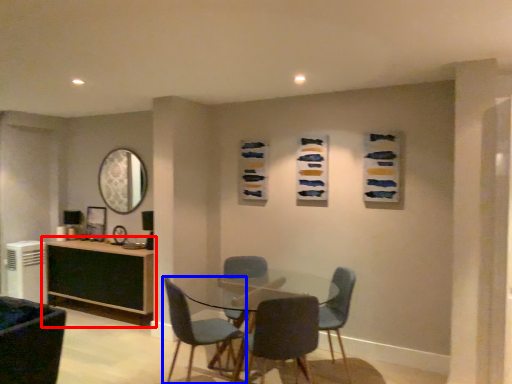
Question: Among these objects, which one is farthest to the camera, desk (highlighted by a red box) or chair (highlighted by a blue box)?

Choices:
 (A) desk
 (B) chair

Answer: (A)